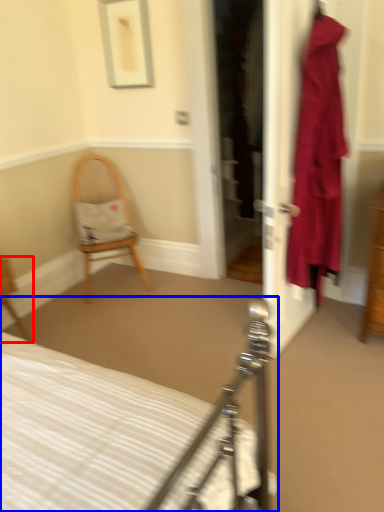
Question: Which object appears closest to the camera in this image, chair (highlighted by a red box) or bed (highlighted by a blue box)?

Choices:
 (A) chair
 (B) bed

Answer: (B)